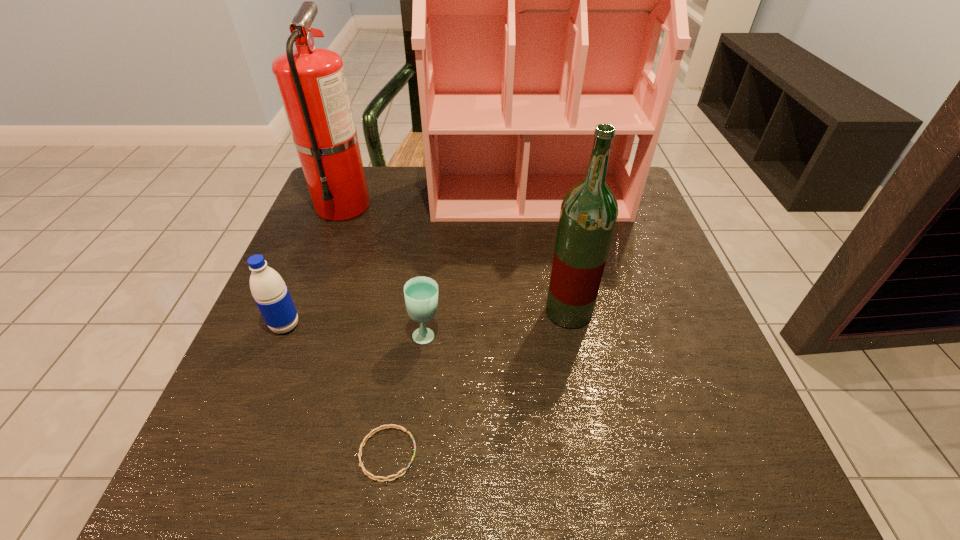
Where is `free space located 0.180m on the front of the third shortest object`? The height and width of the screenshot is (540, 960). free space located 0.180m on the front of the third shortest object is located at coordinates (243, 428).

The width and height of the screenshot is (960, 540). What are the coordinates of `vacant region located on the back of the glass` in the screenshot? It's located at (440, 219).

Locate an element on the screen. blank space located 0.300m on the surface of the bracelet showing star-shaped elements is located at coordinates (616, 454).

At what (x,y) coordinates should I click in order to perform the action: click on dollhouse situated at the far edge. Please return your answer as a coordinate pair (x, y). The image size is (960, 540). Looking at the image, I should click on (538, 0).

You are a GUI agent. You are given a task and a screenshot of the screen. Output one action in this format:
    pyautogui.click(x=<x>, y=<y>)
    Task: Click on the fire extinguisher present at the far edge
    The image size is (960, 540).
    Given the screenshot: What is the action you would take?
    pyautogui.click(x=311, y=82)

Image resolution: width=960 pixels, height=540 pixels. Identify the location of object situated at the near edge. (367, 473).

This screenshot has width=960, height=540. Identify the location of fire extinguisher located in the left edge section of the desktop. (311, 82).

Where is `water bottle positioned at the left edge`? water bottle positioned at the left edge is located at coordinates (271, 295).

Identify the location of object located at the right edge. This screenshot has height=540, width=960. (538, 0).

Where is `object that is at the far left corner`? The height and width of the screenshot is (540, 960). object that is at the far left corner is located at coordinates (311, 82).